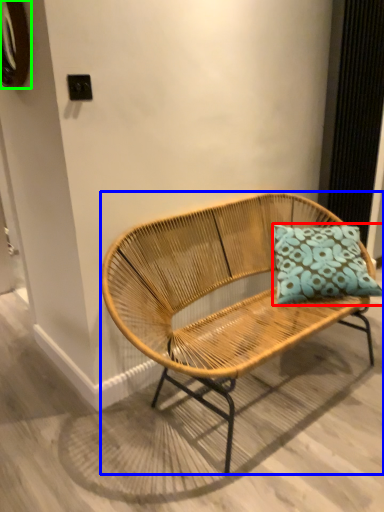
Question: Estimate the real-world distances between objects in this image. Which object is closer to pillow (highlighted by a red box), bench (highlighted by a blue box) or oval (highlighted by a green box)?

Choices:
 (A) bench
 (B) oval

Answer: (A)